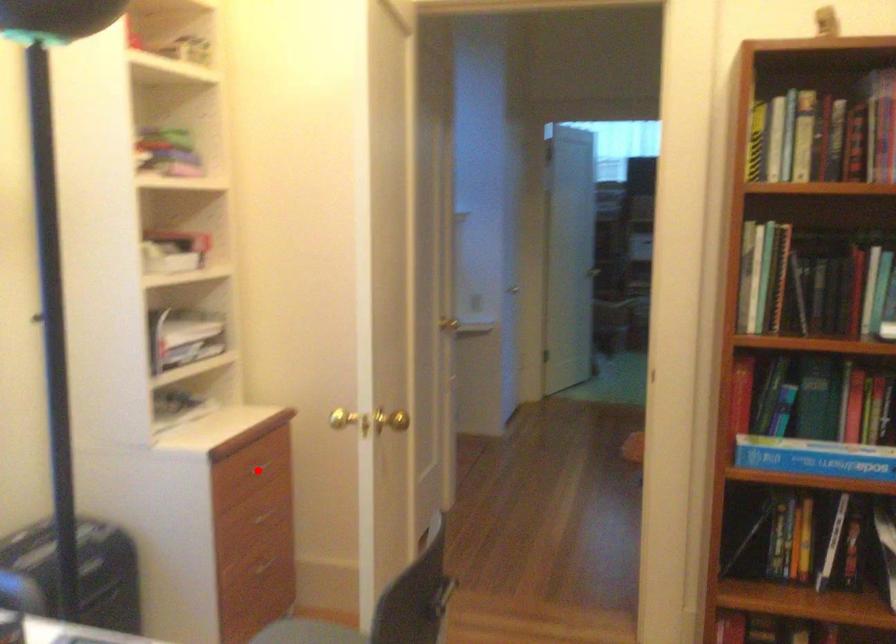
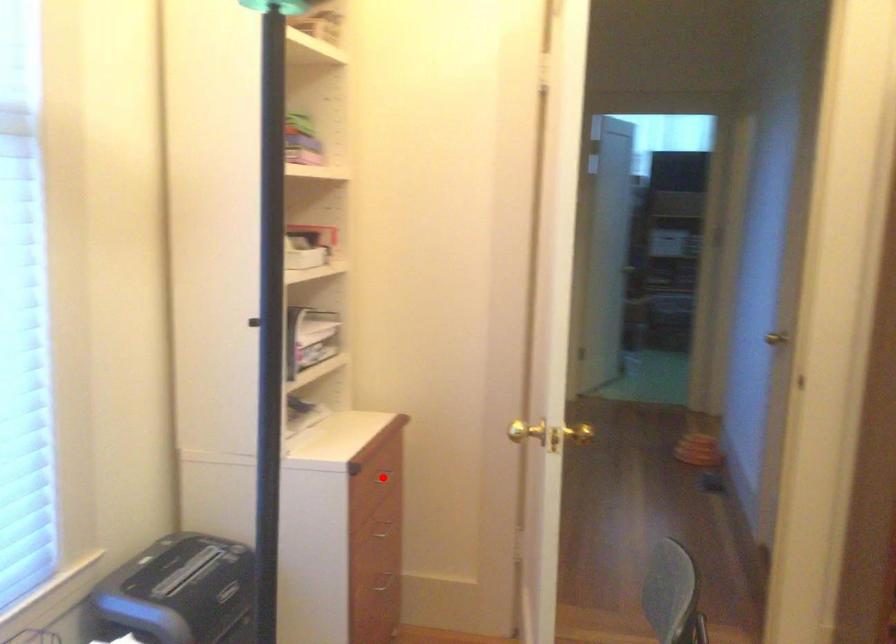
I am providing you with two images of the same scene from different viewpoints. A red point is marked on the first image and another point is marked on the second image. Does the point marked in image1 correspond to the same location as the one in image2?

Yes